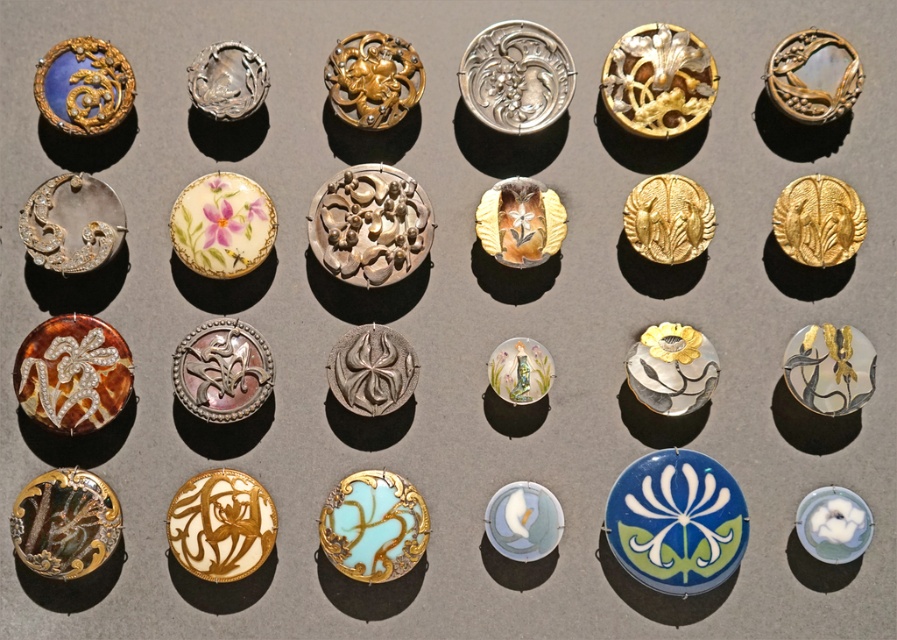
You are an appraiser examining the arrangement of brooches in the image. You need to locate the gold textured brooch at upper right precisely. What are its coordinates?

The gold textured brooch at upper right is located at coordinates point (813, 76).

You are standing 2 meters away from the image. Which object is closer to you? The point at (829, 118) or the camera?

The point at (829, 118) is 1.53 meters from the camera, so the camera is closer to you than the point at (829, 118). Therefore, the camera is closer to you.